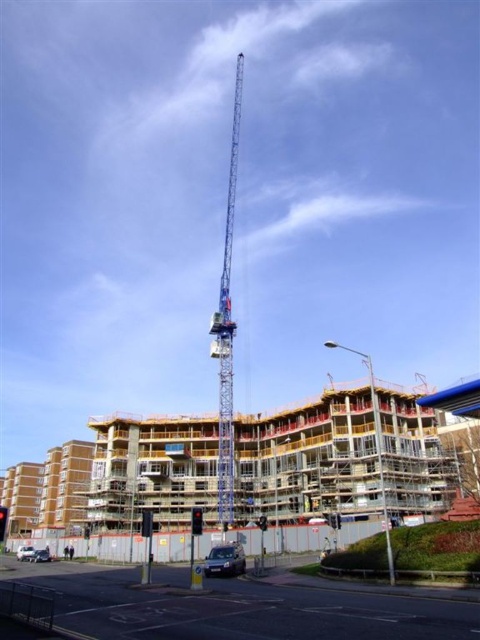
Question: Which point is farther from the camera taking this photo?

Choices:
 (A) (45, 561)
 (B) (211, 564)
 (C) (27, 552)
 (D) (229, 176)

Answer: (D)

Question: Which point appears closest to the camera in this image?

Choices:
 (A) (226, 563)
 (B) (43, 557)
 (C) (236, 97)
 (D) (17, 552)

Answer: (A)

Question: Which point is farther to the camera?

Choices:
 (A) shiny silver car at lower left
 (B) metallic blue crane at center

Answer: (A)

Question: Does metallic blue crane at center appear on the right side of shiny silver car at lower left?

Choices:
 (A) no
 (B) yes

Answer: (B)

Question: Is metallic silver car at lower center smaller than silver metallic car at lower left?

Choices:
 (A) yes
 (B) no

Answer: (B)

Question: In this image, where is metallic blue crane at center located relative to metallic silver car at lower center?

Choices:
 (A) left
 (B) right

Answer: (A)